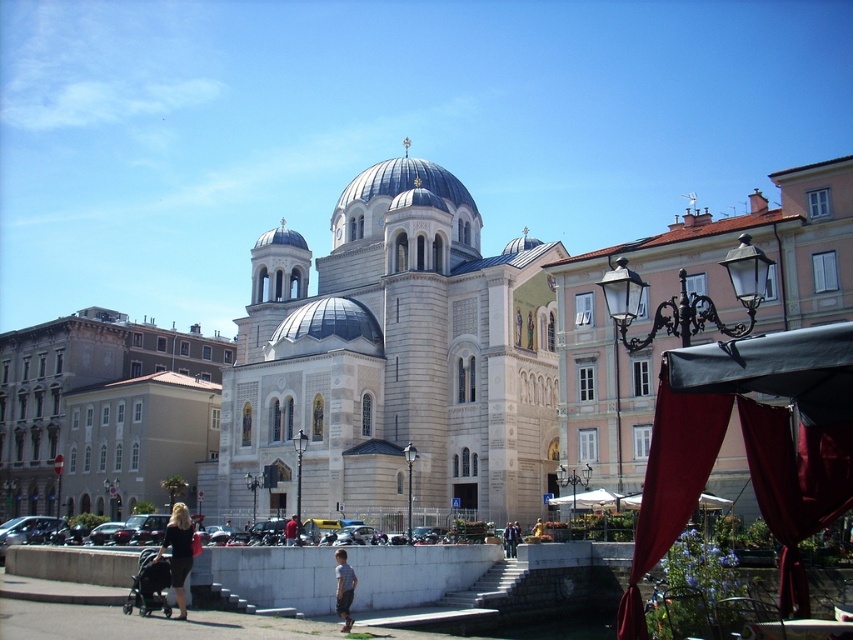
Question: Which of the following is the farthest from the observer?

Choices:
 (A) click(344, 616)
 (B) click(799, 605)

Answer: (A)

Question: Which point is closer to the camera taking this photo?

Choices:
 (A) (178, 538)
 (B) (252, 323)
 (C) (815, 227)

Answer: (A)

Question: Does black fabric dress at lower left lie in front of light brown leather jacket at center?

Choices:
 (A) yes
 (B) no

Answer: (A)

Question: Does matte stone church at center lie behind black fabric canopy at right?

Choices:
 (A) no
 (B) yes

Answer: (B)

Question: Which point is closer to the camera?

Choices:
 (A) (276, 276)
 (B) (289, 540)

Answer: (B)

Question: Is matte stone church at center behind light brown leather jacket at center?

Choices:
 (A) no
 (B) yes

Answer: (A)